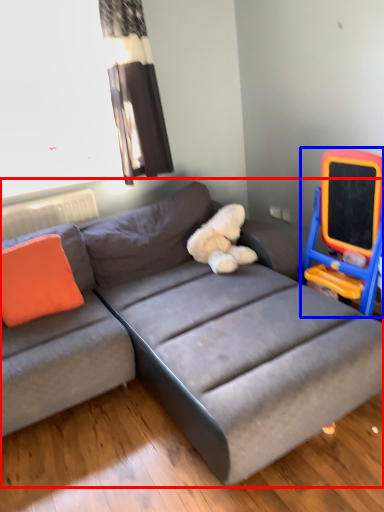
Question: Among these objects, which one is farthest to the camera, studio couch (highlighted by a red box) or rocking chair (highlighted by a blue box)?

Choices:
 (A) studio couch
 (B) rocking chair

Answer: (B)